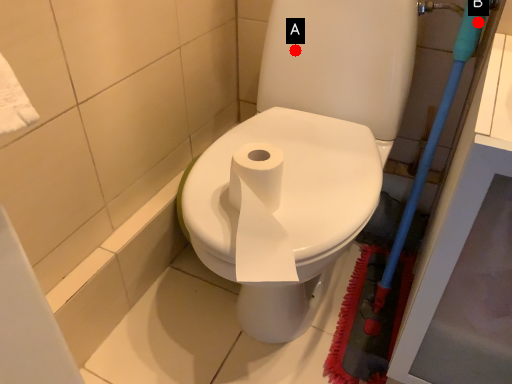
Question: Two points are circled on the image, labeled by A and B beside each circle. Which point appears closest to the camera in this image?

Choices:
 (A) A is closer
 (B) B is closer

Answer: (B)